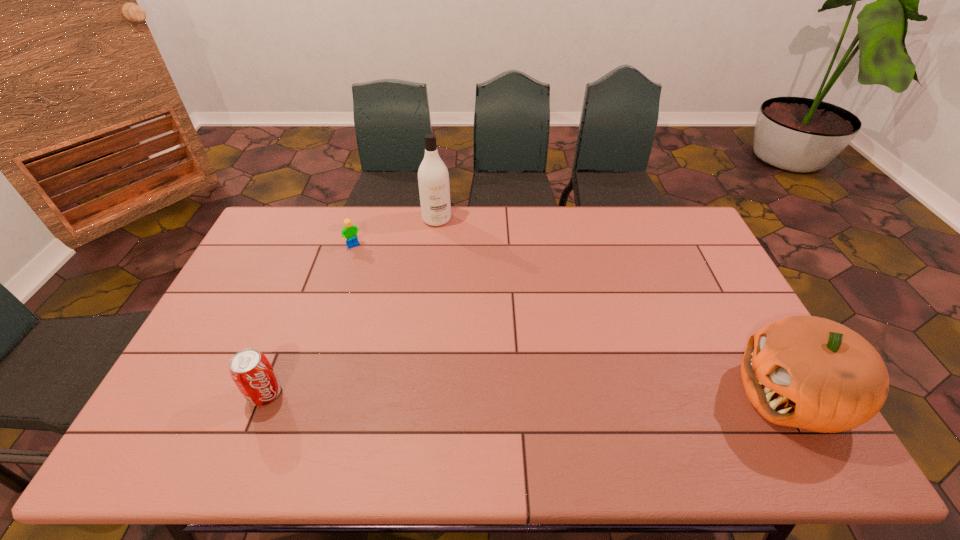
At what (x,y) coordinates should I click in order to perform the action: click on free space that is in between the leftmost object and the second object from right to left. Please return your answer as a coordinate pair (x, y). The height and width of the screenshot is (540, 960). Looking at the image, I should click on (351, 307).

Where is `free space between the leftmost object and the third nearest object`? This screenshot has width=960, height=540. free space between the leftmost object and the third nearest object is located at coordinates (310, 320).

The image size is (960, 540). What are the coordinates of `unoccupied area between the third object from right to left and the second object from right to left` in the screenshot? It's located at (396, 233).

What are the coordinates of `empty space that is in between the third nearest object and the tallest object` in the screenshot? It's located at (396, 233).

Locate an element on the screen. free space between the pumpkin and the second object from left to right is located at coordinates (573, 321).

The width and height of the screenshot is (960, 540). Identify the location of vacant space that is in between the second tallest object and the soda. (528, 394).

You are a GUI agent. You are given a task and a screenshot of the screen. Output one action in this format:
    pyautogui.click(x=<x>, y=<y>)
    Task: Click on the free spot between the shortest object and the pumpkin
    This screenshot has width=960, height=540.
    Given the screenshot: What is the action you would take?
    pyautogui.click(x=573, y=321)

Identify the location of free spot between the rightmost object and the third nearest object. Image resolution: width=960 pixels, height=540 pixels. [x=573, y=321].

Where is `free space between the farthest object and the leftmost object`? Image resolution: width=960 pixels, height=540 pixels. free space between the farthest object and the leftmost object is located at coordinates (351, 307).

Locate which object is the second closest to the second farthest object. Please provide its 2D coordinates. Your answer should be formatted as a tuple, i.e. [(x, y)], where the tuple contains the x and y coordinates of a point satisfying the conditions above.

[(251, 371)]